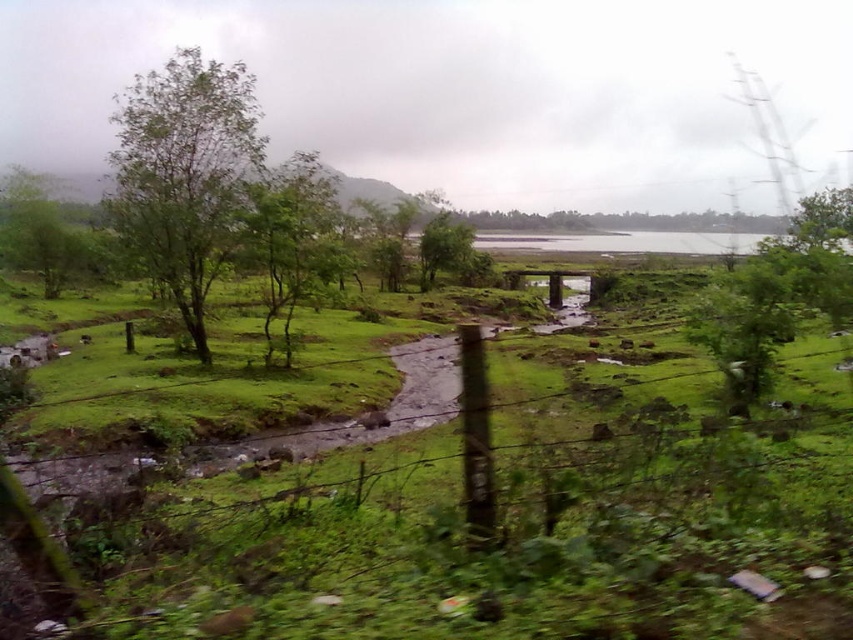
Does point (241, 145) lie behind point (257, 221)?

Yes, it is behind point (257, 221).

Can you confirm if green leafy tree at left is positioned below green leafy tree at center?

Yes.

Is point (178, 67) positioned in front of point (293, 156)?

Yes.

At what (x,y) coordinates should I click in order to perform the action: click on green leafy tree at left. Please return your answer as a coordinate pair (x, y). This screenshot has height=640, width=853. Looking at the image, I should click on (183, 173).